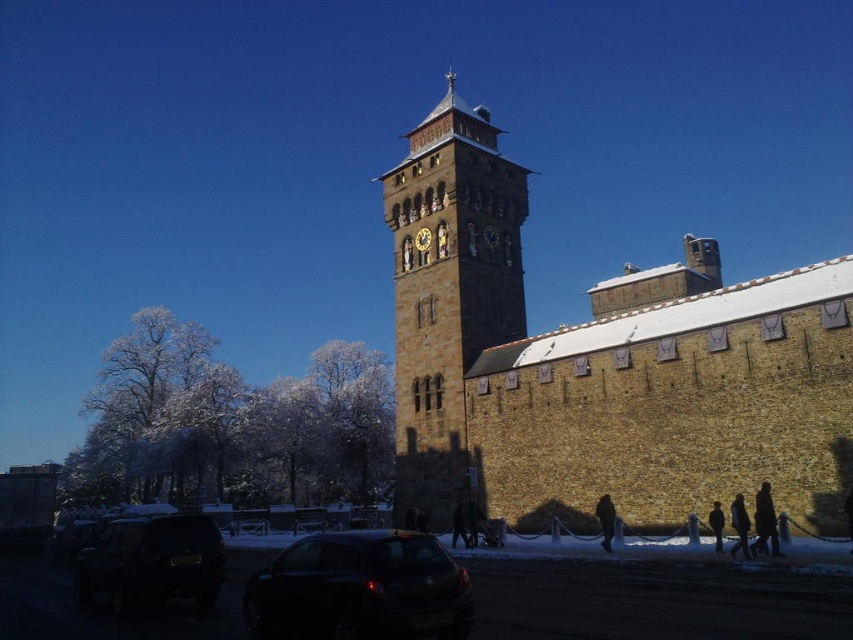
Does black wool coat at lower right have a larger size compared to dark brown leather coat at lower right?

Incorrect, black wool coat at lower right is not larger than dark brown leather coat at lower right.

Is point (770, 524) less distant than point (730, 516)?

Yes, point (770, 524) is in front of point (730, 516).

Between point (759, 548) and point (740, 525), which one is positioned behind?

The point (740, 525) is more distant.

At what (x,y) coordinates should I click in order to perform the action: click on black wool coat at lower right. Please return your answer as a coordinate pair (x, y). Looking at the image, I should click on (764, 522).

Is brown stone clock tower at center behind black matte car at lower left?

Yes, it is behind black matte car at lower left.

Does brown stone clock tower at center appear over black matte car at lower left?

Yes, brown stone clock tower at center is above black matte car at lower left.

Is point (440, 508) closer to camera compared to point (109, 561)?

No.

Find the location of a particular element. brown stone clock tower at center is located at coordinates (448, 291).

Is point (189, 563) behind point (766, 531)?

No, it is in front of (766, 531).

Which is in front, point (190, 589) or point (763, 506)?

Point (190, 589)

Where is `black matte car at lower left`? This screenshot has width=853, height=640. black matte car at lower left is located at coordinates (151, 561).